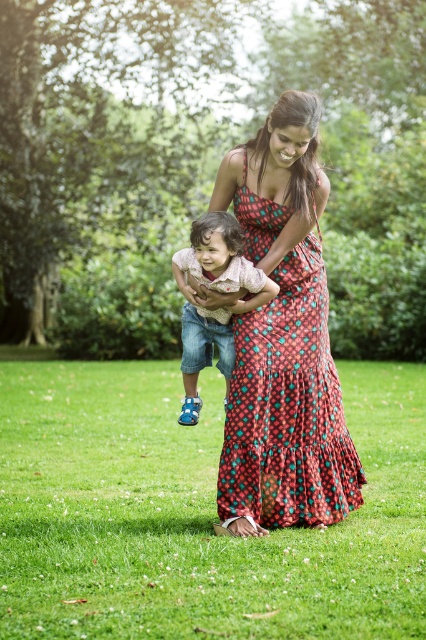
Based on the scene description, where is the green grass at center located in terms of its 2D coordinates?

The green grass at center is located at the 2D coordinates of point (195, 515).

You are planning to lay a picnic blanket in the park. The green grass at center and the matte pink shirt at center are both visible in the area. Which object would be more suitable to place the blanket on, considering their sizes?

The green grass at center is larger in size than the matte pink shirt at center, so placing the picnic blanket on the green grass at center would be more suitable as it provides a larger and appropriate surface for the blanket.

Based on the photo, you are planning to take a photo of the green grass at center and the matte pink shirt at center. Which object occupies more horizontal space in the image?

The green grass at center is wider than the matte pink shirt at center, so it occupies more horizontal space in the image.